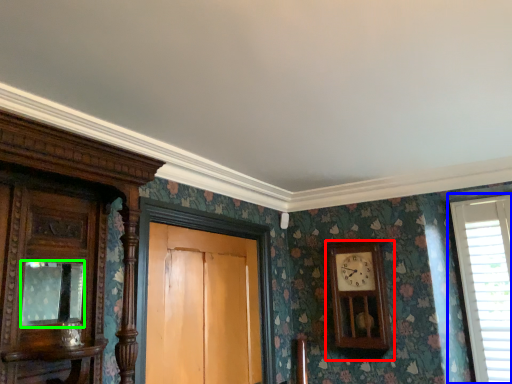
Question: Based on their relative distances, which object is farther from wall clock (highlighted by a red box)? Choose from window (highlighted by a blue box) and mirror (highlighted by a green box).

Choices:
 (A) window
 (B) mirror

Answer: (B)